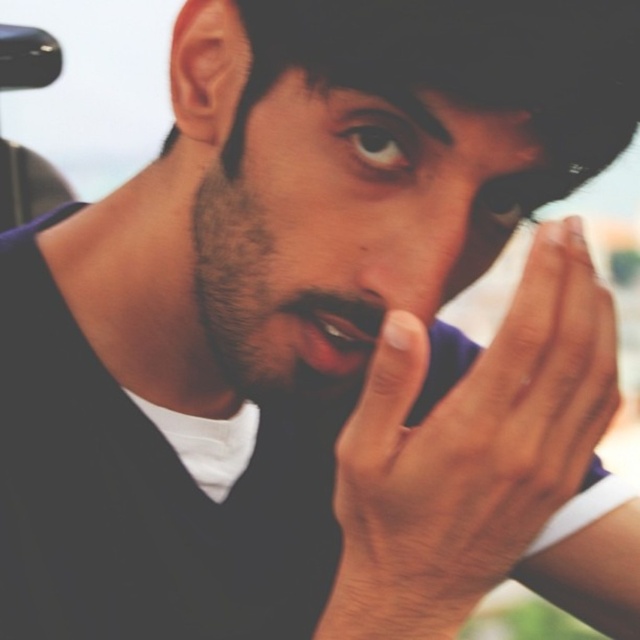
Is dry skin hand at center below smooth glossy lips at center?

Yes, dry skin hand at center is below smooth glossy lips at center.

Is point (452, 435) farther from camera compared to point (282, 305)?

No, it is in front of (282, 305).

Between point (522, 433) and point (326, 330), which one is positioned in front?

Point (522, 433) is in front.

Image resolution: width=640 pixels, height=640 pixels. In order to click on dry skin hand at center in this screenshot , I will do pyautogui.click(x=468, y=451).

Between smooth skin face at center and smooth skin nose at center, which one appears on the left side from the viewer's perspective?

Positioned to the left is smooth skin face at center.

Can you confirm if smooth skin face at center is shorter than smooth skin nose at center?

No, smooth skin face at center is not shorter than smooth skin nose at center.

The width and height of the screenshot is (640, 640). Describe the element at coordinates (342, 224) in the screenshot. I see `smooth skin face at center` at that location.

At what (x,y) coordinates should I click in order to perform the action: click on smooth skin face at center. Please return your answer as a coordinate pair (x, y). Image resolution: width=640 pixels, height=640 pixels. Looking at the image, I should click on (342, 224).

Can you confirm if smooth skin face at center is wider than smooth glossy lips at center?

Indeed, smooth skin face at center has a greater width compared to smooth glossy lips at center.

Who is more distant from viewer, (484, 259) or (321, 348)?

The point (484, 259) is more distant.

Which is behind, point (259, 128) or point (298, 301)?

The point (259, 128) is behind.

Identify the location of smooth skin face at center. tap(342, 224).